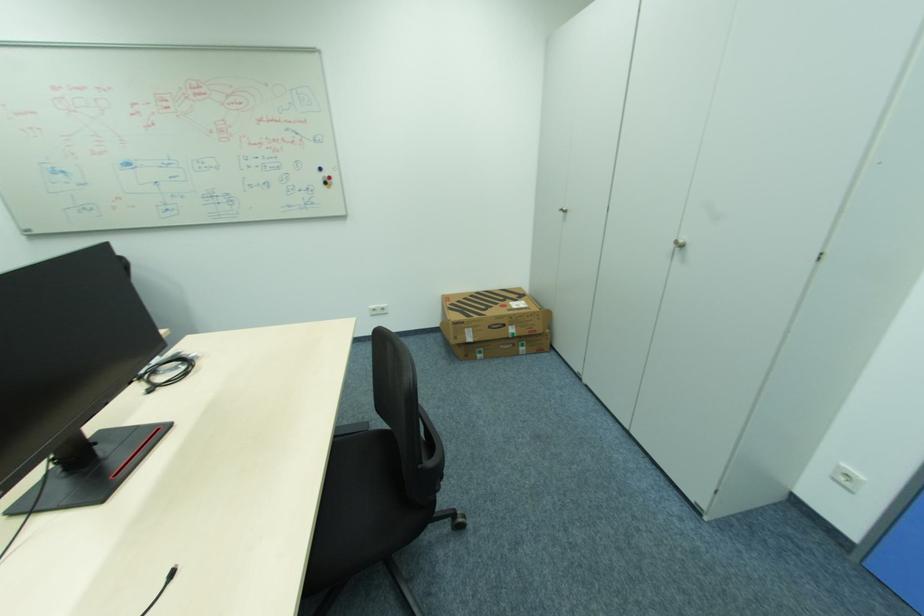
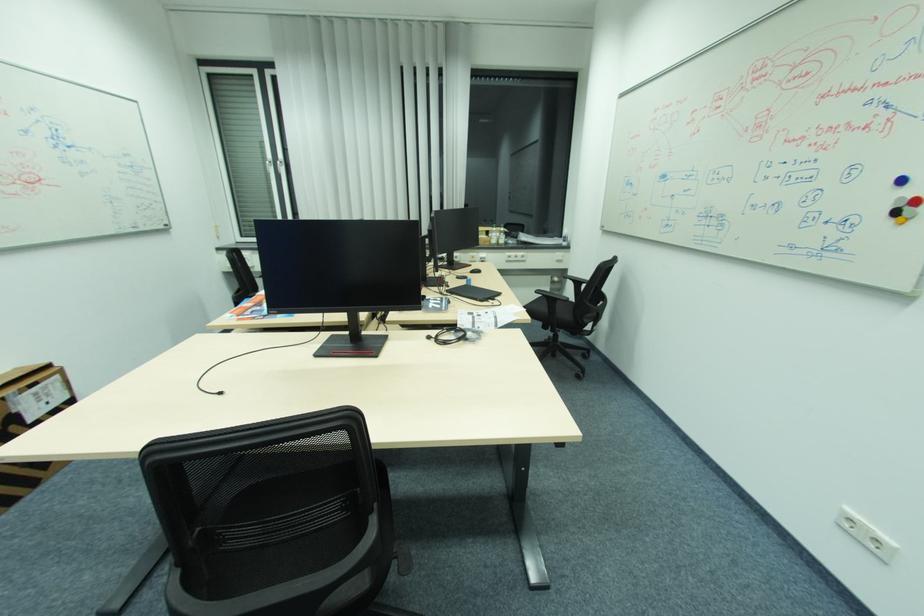
In the second image, find the point that corresponds to the point at 331,180 in the first image.

(907, 206)